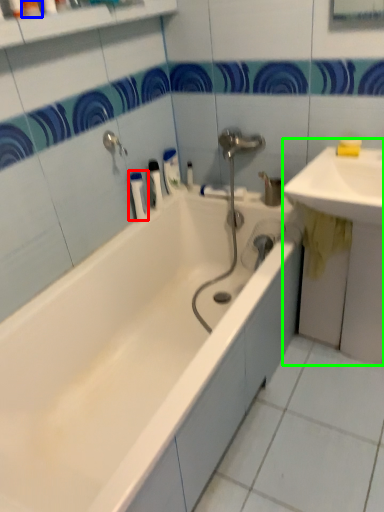
Question: Which is farther away from toiletry (highlighted by a red box)? toiletry (highlighted by a blue box) or sink (highlighted by a green box)?

Choices:
 (A) toiletry
 (B) sink

Answer: (B)